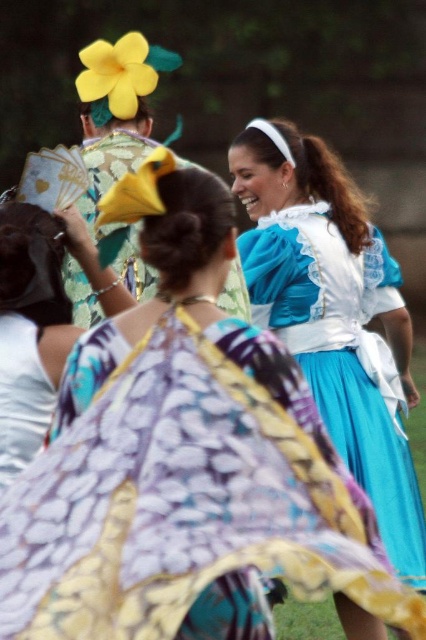
Who is more forward, (19, 211) or (100, 212)?

Positioned in front is point (100, 212).

Between matte yellow fabric at center and yellow paper fan at upper left, which one appears on the left side from the viewer's perspective?

matte yellow fabric at center is more to the left.

Does point (51, 250) come behind point (114, 186)?

No, (51, 250) is closer to viewer.

Find the location of a particular element. The width and height of the screenshot is (426, 640). matte yellow fabric at center is located at coordinates (29, 330).

Does matte yellow fabric at center have a lesser height compared to yellow fabric flower at upper center?

In fact, matte yellow fabric at center may be taller than yellow fabric flower at upper center.

Between point (40, 244) and point (123, 68), which one is positioned behind?

The point (123, 68) is behind.

Find the location of a particular element. matte yellow fabric at center is located at coordinates (29, 330).

Identify the location of matte yellow fabric at center. (29, 330).

Who is positioned more to the left, blue satin dress at center or matte yellow fabric at center?

Positioned to the left is matte yellow fabric at center.

Between point (322, 144) and point (40, 436), which one is positioned behind?

The point (322, 144) is behind.

Locate an element on the screen. This screenshot has width=426, height=640. blue satin dress at center is located at coordinates (333, 314).